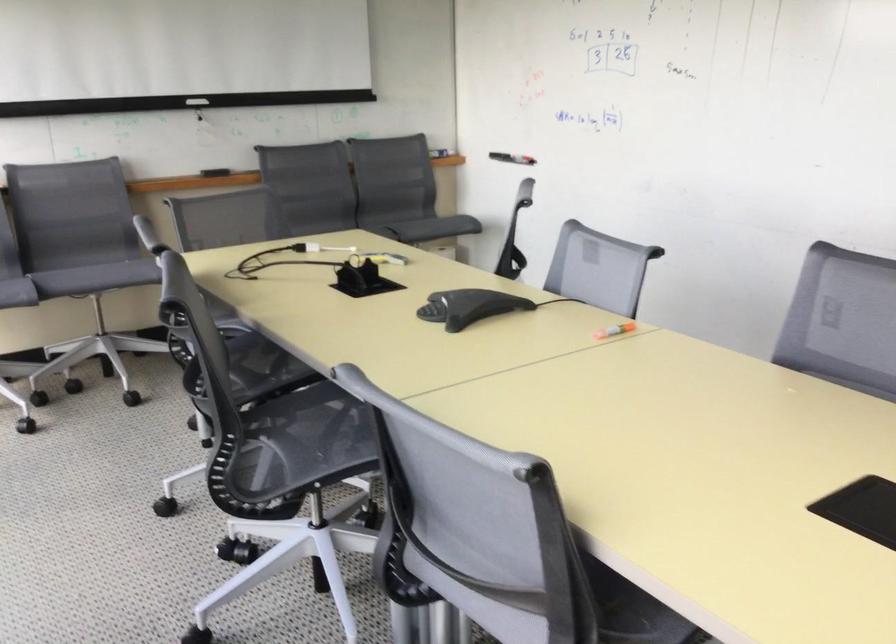
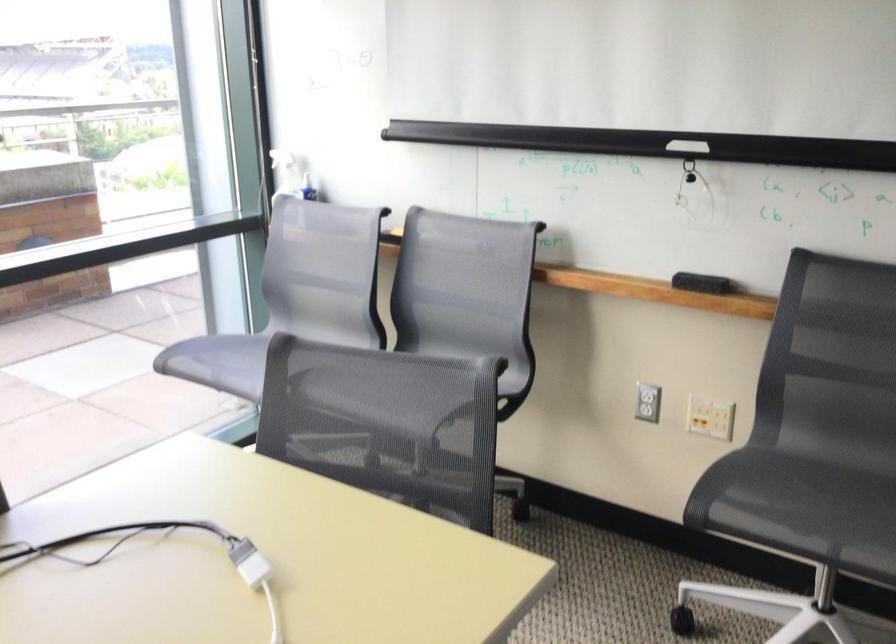
Where in the second image is the point corresponding to (271,265) from the first image?

(161, 554)